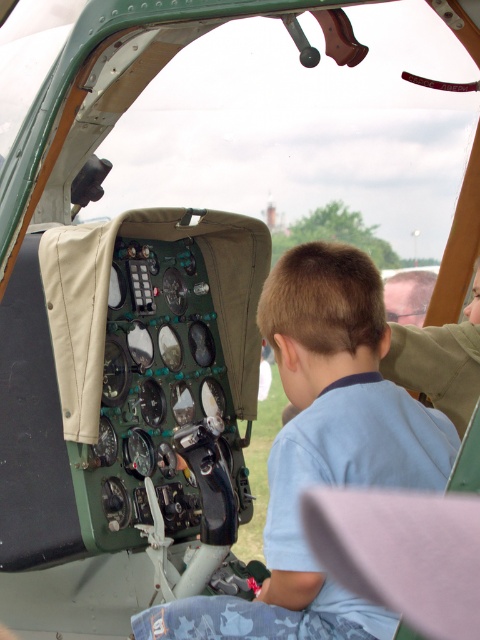
In order to click on light blue shirt at center in this screenshot , I will do `click(322, 451)`.

Which is behind, point (354, 392) or point (395, 355)?

The point (395, 355) is more distant.

The width and height of the screenshot is (480, 640). Find the location of `light blue shirt at center`. light blue shirt at center is located at coordinates (322, 451).